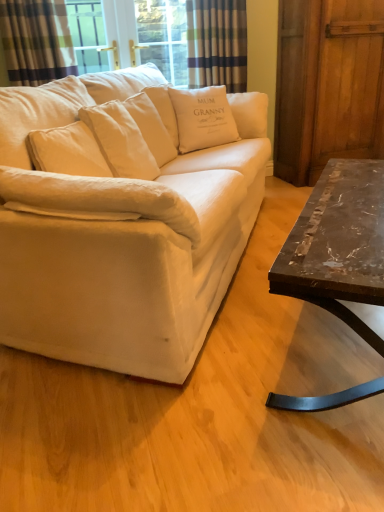
Identify the location of free space to the left of marble/black metal coffee table at right. (195, 360).